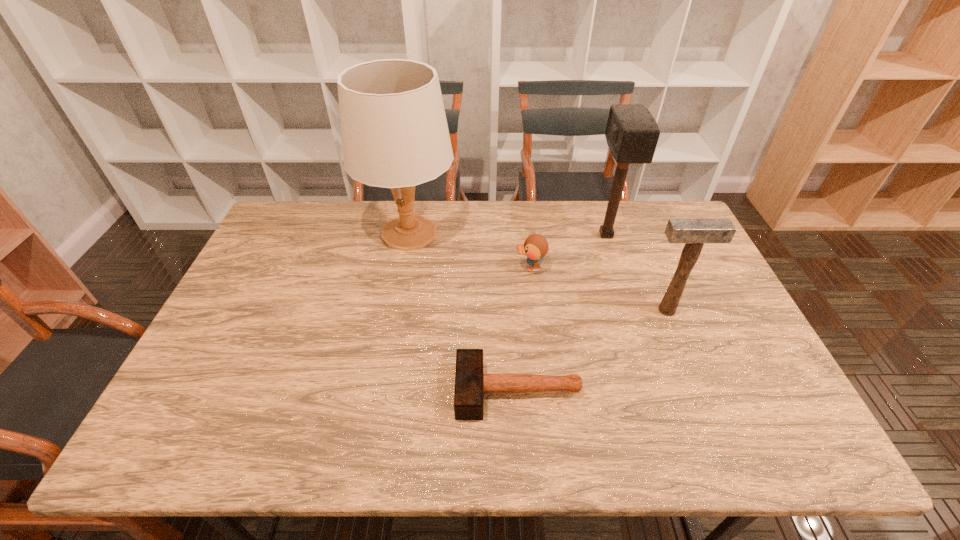
At what (x,y) coordinates should I click in order to perform the action: click on object at the near edge. Please return your answer as a coordinate pair (x, y). Image resolution: width=960 pixels, height=540 pixels. Looking at the image, I should click on (470, 383).

Identify the location of object situated at the right edge. (694, 232).

You are a GUI agent. You are given a task and a screenshot of the screen. Output one action in this format:
    pyautogui.click(x=<x>, y=<y>)
    Task: Click on the vacant space at the far edge of the desktop
    
    Given the screenshot: What is the action you would take?
    point(587,204)

This screenshot has height=540, width=960. Find the location of `free location at the near edge of the desktop`. free location at the near edge of the desktop is located at coordinates (488, 451).

Locate an element on the screen. The image size is (960, 540). vacant space at the left edge of the desktop is located at coordinates (247, 303).

Image resolution: width=960 pixels, height=540 pixels. I want to click on vacant point at the right edge, so click(713, 382).

In the image, there is a desktop. Find the location of `free space at the far left corner`. free space at the far left corner is located at coordinates (317, 221).

Where is `free space at the far right corner`? This screenshot has width=960, height=540. free space at the far right corner is located at coordinates point(661,240).

Identify the location of vacant space at the near right corner. (783, 431).

Locate an element on the screen. This screenshot has height=540, width=960. empty space between the shortest object and the fourth farthest object is located at coordinates (592, 350).